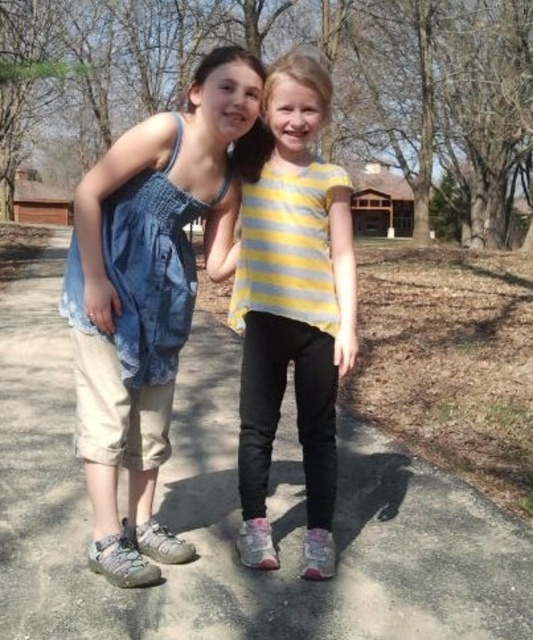
You are a photographer planning to take a photo of the two girls standing on the smooth concrete path at center. Since the denim fabric at center is part of their clothing, will it be visible in the photo?

The smooth concrete path at center is positioned under denim fabric at center, so the denim fabric at center will cover the path and thus be visible in the photo.

You are a photographer standing in front of the two girls. You want to take a photo that includes both the smooth concrete path at center and the yellow striped shirt at center. Which object should you focus on first to ensure both are in focus?

You should focus on the yellow striped shirt at center first because it is closer to you than the smooth concrete path at center, which is further away. By focusing on the closer object, the path will still be in focus due to depth of field.

You are a photographer trying to capture a photo of the two girls. You notice two points marked in the scene. The first point is at coordinates point (160,116), and the second point is at coordinates point (300,88). Which of these two points is closer to the camera?

Point (160,116) is in front of point (300,88), so it is closer to the camera.